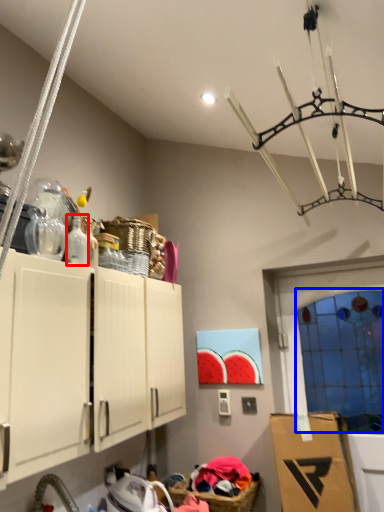
Question: Among these objects, which one is nearest to the camera, bottle (highlighted by a red box) or glass door (highlighted by a blue box)?

Choices:
 (A) bottle
 (B) glass door

Answer: (A)